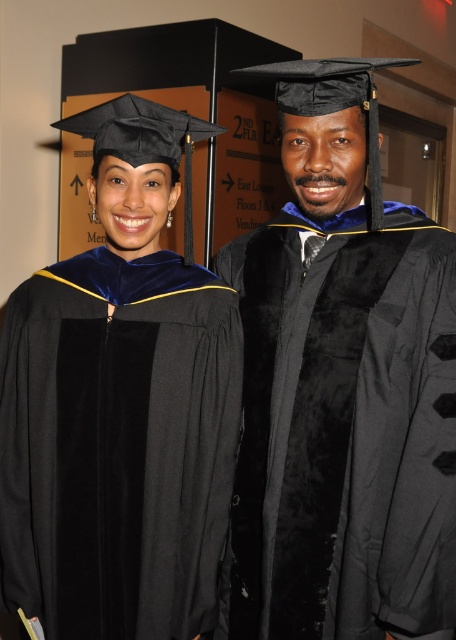
Between point (327, 532) and point (134, 356), which one is positioned behind?

Positioned behind is point (134, 356).

Between point (326, 573) and point (231, 388), which one is positioned in front?

Point (326, 573) is more forward.

Locate an element on the screen. The width and height of the screenshot is (456, 640). black matte graduation gown at center is located at coordinates click(342, 387).